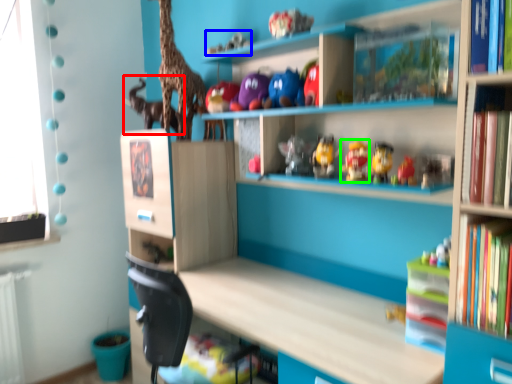
Question: Which is nearer to the animal (highlighted by a red box)? toy (highlighted by a blue box) or toy (highlighted by a green box).

Choices:
 (A) toy
 (B) toy

Answer: (A)